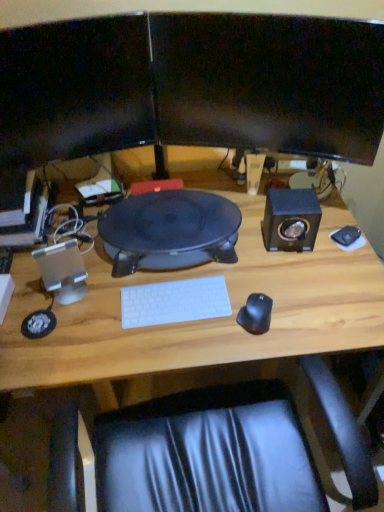
The height and width of the screenshot is (512, 384). What are the coordinates of `vacant point to the right of black rubberized mouse at right, the second mouse when ordered from top to bottom` in the screenshot? It's located at (313, 313).